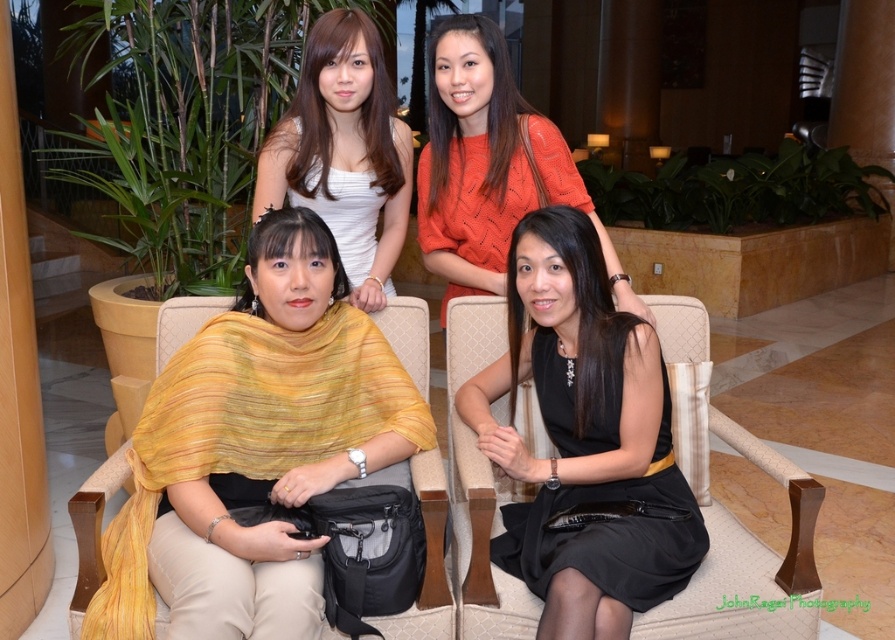
You are a photographer setting up a shoot in this scene. You need to place a spotlight on the closest object between the black satin dress at center and the white satin dress at upper center. Which dress should you choose?

The black satin dress at center is closer to the viewer than the white satin dress at upper center, so you should place the spotlight on the black satin dress at center.

You are a photographer setting up for a group photo. You need to ensure that the black satin dress at center and the white satin dress at upper center are at least 1 meter apart for proper lighting. Based on the current setup, will you need to adjust their positions?

The black satin dress at center is 79.16 centimeters from the white satin dress at upper center. Since 79.16 cm is less than 1 meter, you will need to adjust their positions to meet the required distance for proper lighting.